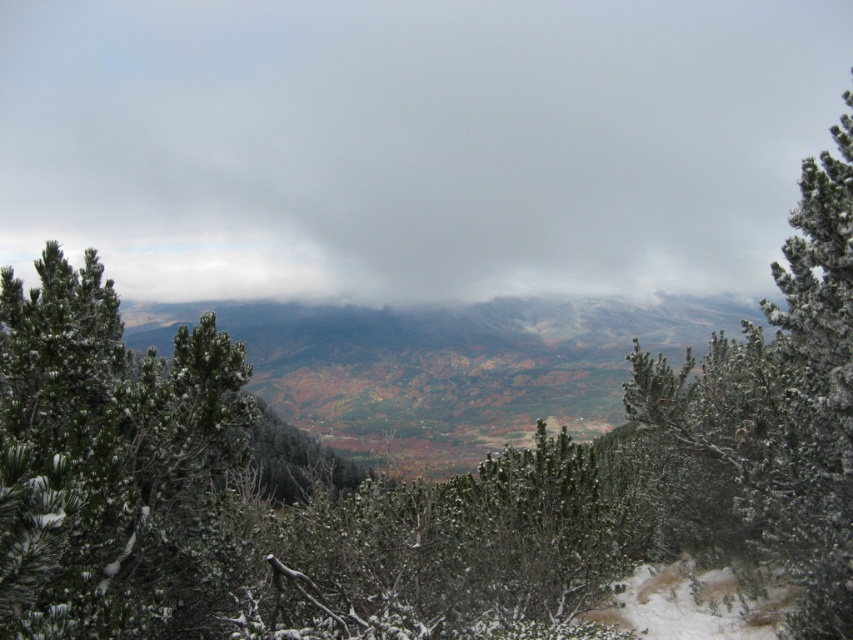
Question: Is green matte tree at center wider than white frosty pine at upper right?

Choices:
 (A) yes
 (B) no

Answer: (B)

Question: Is green matte tree at center thinner than white frosty pine at upper right?

Choices:
 (A) yes
 (B) no

Answer: (A)

Question: Which point is closer to the camera?

Choices:
 (A) (799, 600)
 (B) (91, 403)

Answer: (B)

Question: Which object is the farthest from the green matte tree at center?

Choices:
 (A) white frosty pine at upper right
 (B) white fluffy cloud at upper center

Answer: (B)

Question: Which object is farther from the camera taking this photo?

Choices:
 (A) white fluffy cloud at upper center
 (B) green matte tree at center
 (C) white frosty pine at upper right

Answer: (A)

Question: Can you confirm if white fluffy cloud at upper center is wider than white frosty pine at upper right?

Choices:
 (A) no
 (B) yes

Answer: (B)